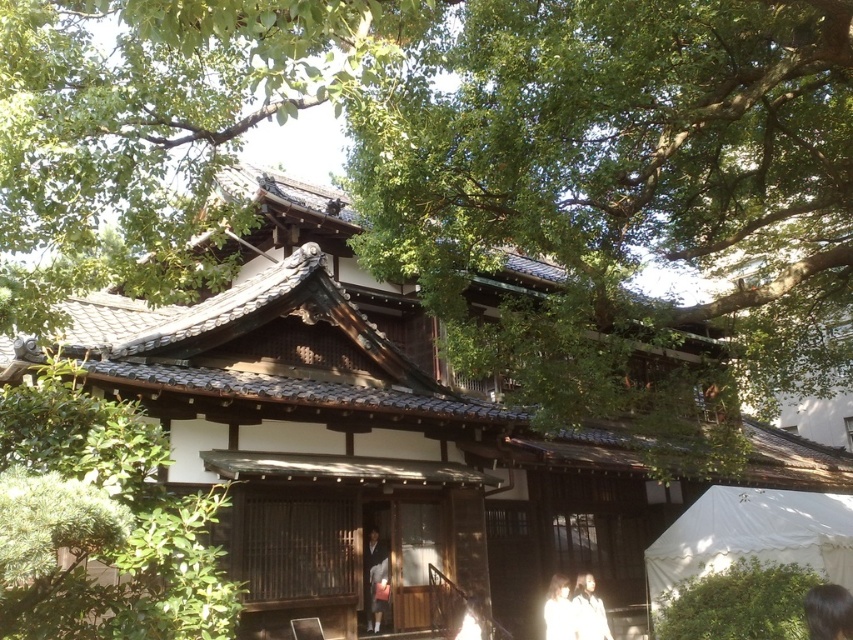
You are standing in front of a traditional Japanese building and see a green leafy tree at upper center and a white fabric person at lower right. Which object is higher in the image?

The green leafy tree at upper center is higher in the image than the white fabric person at lower right.

You are standing in front of the traditional Japanese building and see the matte black kimono at center and the white matte jacket at lower right. Which clothing item is closer to you?

The matte black kimono at center is closer to you because it is further to the viewer than the white matte jacket at lower right.

You are a photographer trying to capture the scene of the traditional Japanese building. You notice the matte black kimono at center and the white matte jacket at lower right. Which clothing item is positioned higher in the image?

The matte black kimono at center is positioned higher than the white matte jacket at lower right.